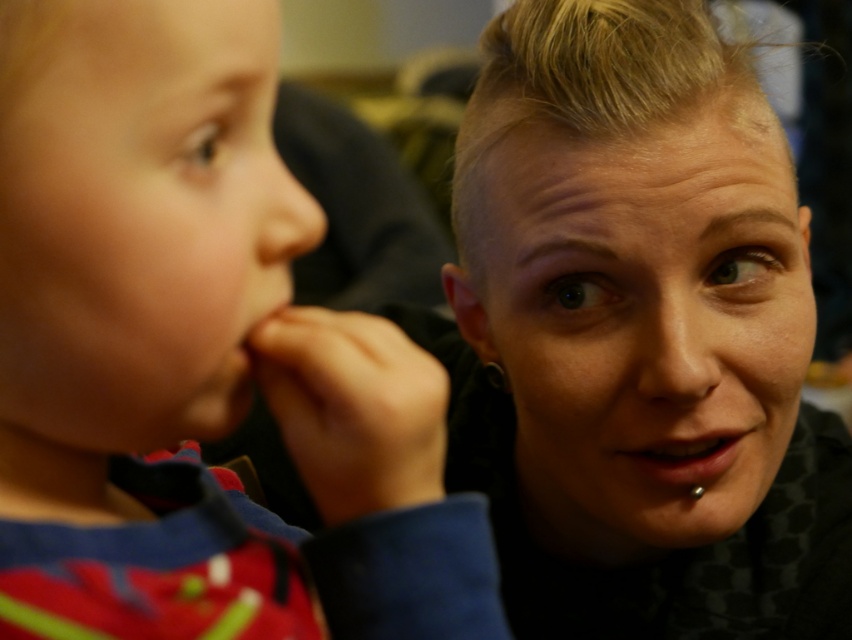
Question: Among these objects, which one is nearest to the camera?

Choices:
 (A) smooth skin baby at left
 (B) matte red shirt at left

Answer: (A)

Question: Is smooth skin face at right closer to the viewer compared to smooth skin baby at left?

Choices:
 (A) yes
 (B) no

Answer: (B)

Question: Is matte red shirt at left positioned before smooth flesh mouth at center?

Choices:
 (A) no
 (B) yes

Answer: (B)

Question: Among these points, which one is nearest to the camera?

Choices:
 (A) (318, 451)
 (B) (87, 72)
 (C) (766, 154)

Answer: (B)

Question: Can you confirm if smooth skin face at right is thinner than smooth flesh mouth at center?

Choices:
 (A) yes
 (B) no

Answer: (B)

Question: Which point is closer to the camera?

Choices:
 (A) (639, 467)
 (B) (597, 336)

Answer: (B)